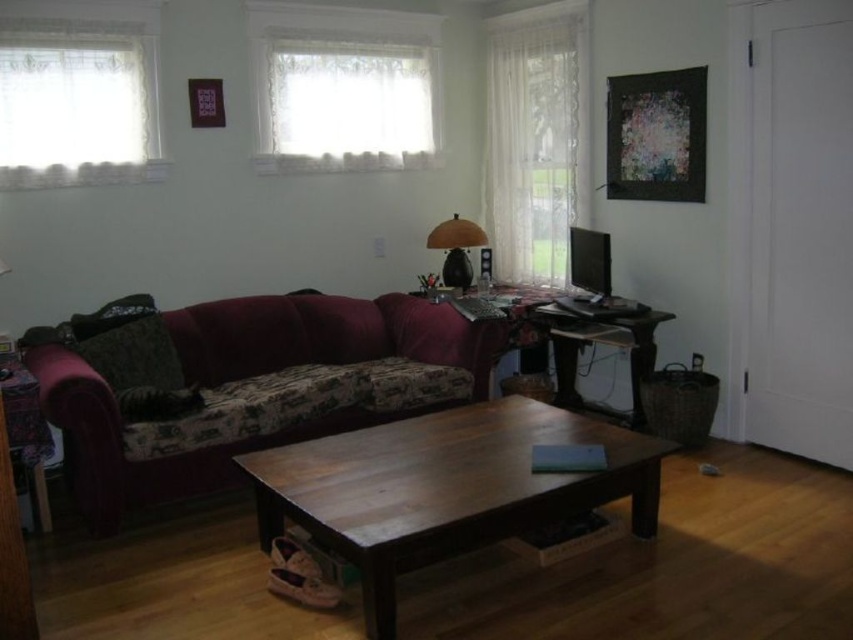
You are standing in the living room and want to reach the white lace curtain at upper right located at point (535, 144). Is there any object between you and the curtain that might block your path?

The white lace curtain at upper right is located at point (535, 144). Since there are no objects mentioned between you and the curtain, your path is clear.

You are moving a 1.2 meter wide painting and need to hang it on the wall. The painting is too big to fit through any doorways. You have to hang it either on the wall where the white lace curtain at upper right is or on the wall where the wooden desk at center is. Which wall can you choose?

The wooden desk at center is on a wall with more width than the white lace curtain at upper right. Since the painting is 1.2 meters wide, you should choose the wall with the wooden desk at center because it has enough space.

You are standing in the living room and want to move from the point at coordinates point (328, 358) to the point at coordinates point (650, 371). Which direction should you move to get closer to your destination?

To move from point (328, 358) to point (650, 371), you should move upwards and slightly to the right since the destination point is higher and to the right in the coordinate system.